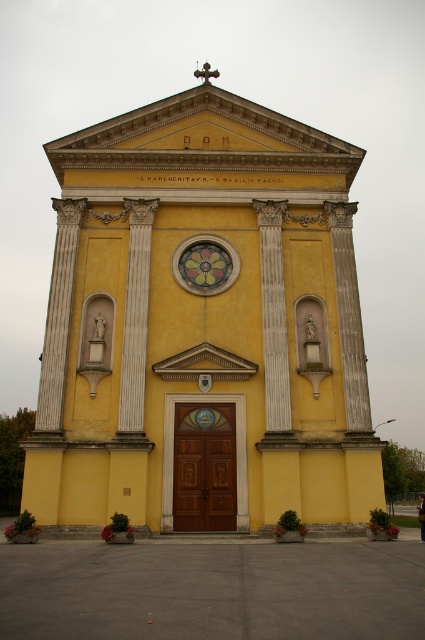
Who is positioned more to the right, yellow matte church at center or stained glass window at center?

yellow matte church at center is more to the right.

The height and width of the screenshot is (640, 425). In order to click on yellow matte church at center in this screenshot , I will do `click(203, 326)`.